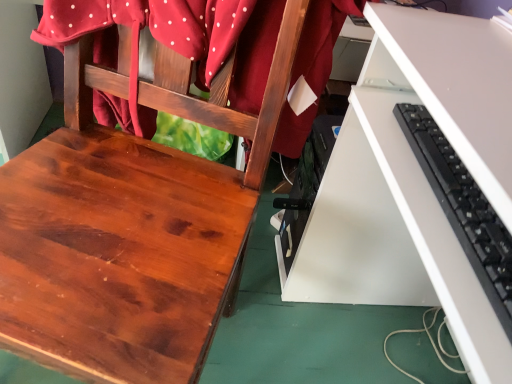
Question: From a real-world perspective, is black plastic keyboard at right beneath shiny wood chair at center?

Choices:
 (A) no
 (B) yes

Answer: (A)

Question: Is black plastic keyboard at right in front of shiny wood chair at center?

Choices:
 (A) no
 (B) yes

Answer: (A)

Question: Is black plastic keyboard at right not within shiny wood chair at center?

Choices:
 (A) no
 (B) yes

Answer: (B)

Question: Is black plastic keyboard at right facing towards shiny wood chair at center?

Choices:
 (A) yes
 (B) no

Answer: (A)

Question: From the image's perspective, does black plastic keyboard at right appear lower than shiny wood chair at center?

Choices:
 (A) no
 (B) yes

Answer: (B)

Question: Is point (77, 231) positioned closer to the camera than point (136, 26)?

Choices:
 (A) closer
 (B) farther

Answer: (A)

Question: From a real-world perspective, is shiny wood chair at center above or below matte red fabric at upper left?

Choices:
 (A) below
 (B) above

Answer: (A)

Question: Would you say shiny wood chair at center is inside or outside matte red fabric at upper left?

Choices:
 (A) outside
 (B) inside

Answer: (A)

Question: From the image's perspective, is shiny wood chair at center located above or below matte red fabric at upper left?

Choices:
 (A) above
 (B) below

Answer: (B)

Question: Is point (477, 251) closer or farther from the camera than point (154, 79)?

Choices:
 (A) closer
 (B) farther

Answer: (A)

Question: Based on their sizes in the image, would you say black plastic keyboard at right is bigger or smaller than shiny wood chair at center?

Choices:
 (A) small
 (B) big

Answer: (A)

Question: Relative to shiny wood chair at center, is black plastic keyboard at right in front or behind?

Choices:
 (A) behind
 (B) front

Answer: (A)

Question: From the image's perspective, relative to shiny wood chair at center, is black plastic keyboard at right above or below?

Choices:
 (A) above
 (B) below

Answer: (B)

Question: Is white matte desk at lower right to the left or to the right of matte red fabric at upper left in the image?

Choices:
 (A) right
 (B) left

Answer: (A)

Question: Considering the positions of white matte desk at lower right and matte red fabric at upper left in the image, is white matte desk at lower right taller or shorter than matte red fabric at upper left?

Choices:
 (A) short
 (B) tall

Answer: (B)